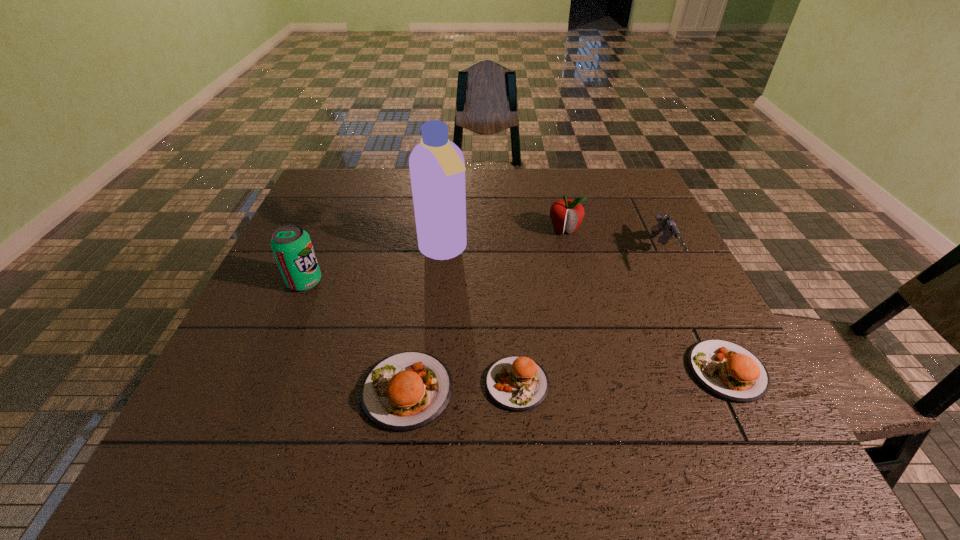
I want to click on vacant area in the image that satisfies the following two spatial constraints: 1. on the front-facing side of the second tallest object; 2. on the left side of the second patty from left to right, so click(260, 383).

Find the location of a particular element. The image size is (960, 540). free location that satisfies the following two spatial constraints: 1. on the front-facing side of the leftmost object; 2. on the back side of the leftmost patty is located at coordinates (257, 390).

Where is `free location that satisfies the following two spatial constraints: 1. at the barrel of the gun; 2. on the front-facing side of the sixth shortest object`? This screenshot has height=540, width=960. free location that satisfies the following two spatial constraints: 1. at the barrel of the gun; 2. on the front-facing side of the sixth shortest object is located at coordinates (675, 282).

Where is `vacant space that satisfies the following two spatial constraints: 1. on the front side of the shortest patty; 2. on the right side of the shampoo`? The image size is (960, 540). vacant space that satisfies the following two spatial constraints: 1. on the front side of the shortest patty; 2. on the right side of the shampoo is located at coordinates (430, 383).